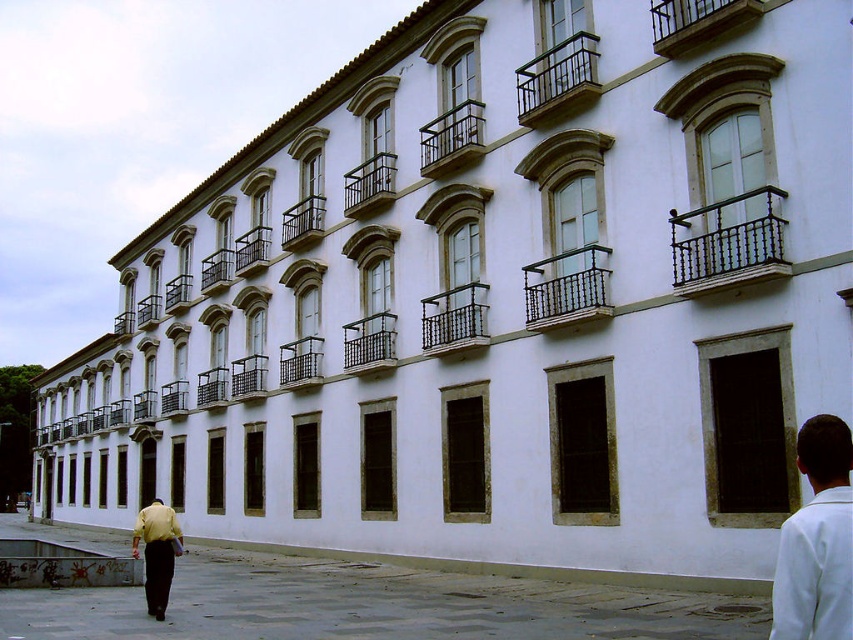
You are standing in the courtyard of the building and notice two shirts hanging on a line between two balconies. The shirts are the white matte shirt at lower right and the yellow shirt at lower left. Which shirt has a smaller width?

The white matte shirt at lower right has a lesser width compared to the yellow shirt at lower left, so the white matte shirt at lower right is smaller in width.

You are standing in the courtyard of the building and see two people wearing the white matte shirt at lower right and the yellow shirt at lower left. Which person is shorter?

The person wearing the white matte shirt at lower right is shorter because the white matte shirt at lower right has a lesser height compared to the yellow shirt at lower left.